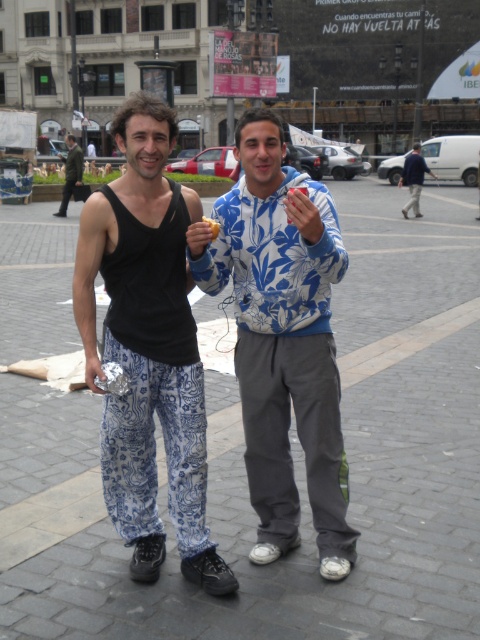
Question: Which object is the farthest from the blue floral hoodie at center?

Choices:
 (A) white paper food at center
 (B) black cotton tank top at center
 (C) matte black hand at center

Answer: (A)

Question: Is blue floral hoodie at center thinner than dark blue jacket at upper right?

Choices:
 (A) yes
 (B) no

Answer: (A)

Question: Which point is closer to the camera?

Choices:
 (A) white paper food at center
 (B) camouflage jacket at left
 (C) brick pavement at center

Answer: (A)

Question: Does black cotton tank top at center lie behind camouflage jacket at left?

Choices:
 (A) no
 (B) yes

Answer: (A)

Question: Is black cotton tank top at center closer to the viewer compared to blue floral hoodie at center?

Choices:
 (A) yes
 (B) no

Answer: (B)

Question: Among these points, which one is nearest to the camera?

Choices:
 (A) (315, 380)
 (B) (193, 252)
 (C) (64, 196)

Answer: (B)